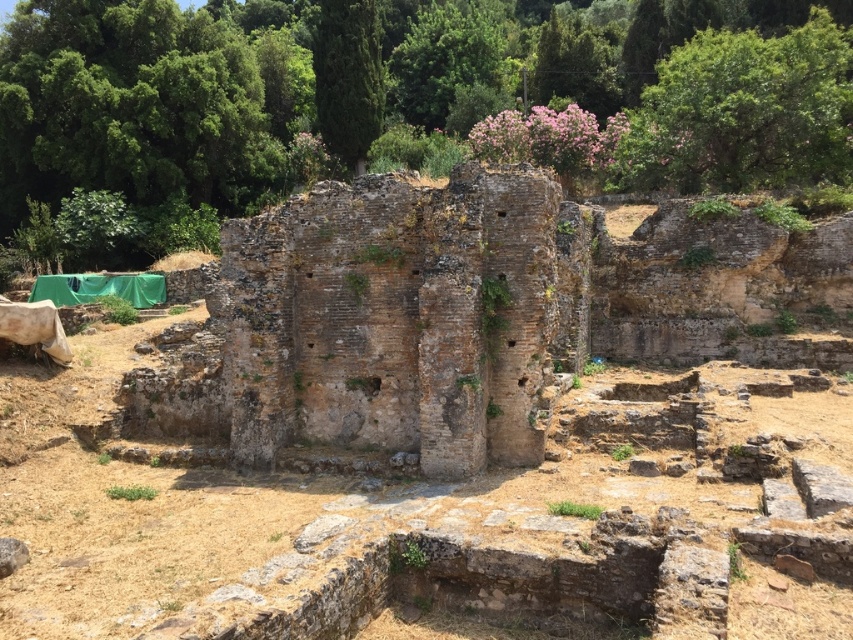
You are an archaeologist standing at the archaeological site. You notice two points marked on your map at coordinates point (485, 317) and point (701, 150). Which point is closer to you when you are facing the ruins?

Point (485, 317) is in front of point (701, 150), so it is closer to you when facing the ruins.